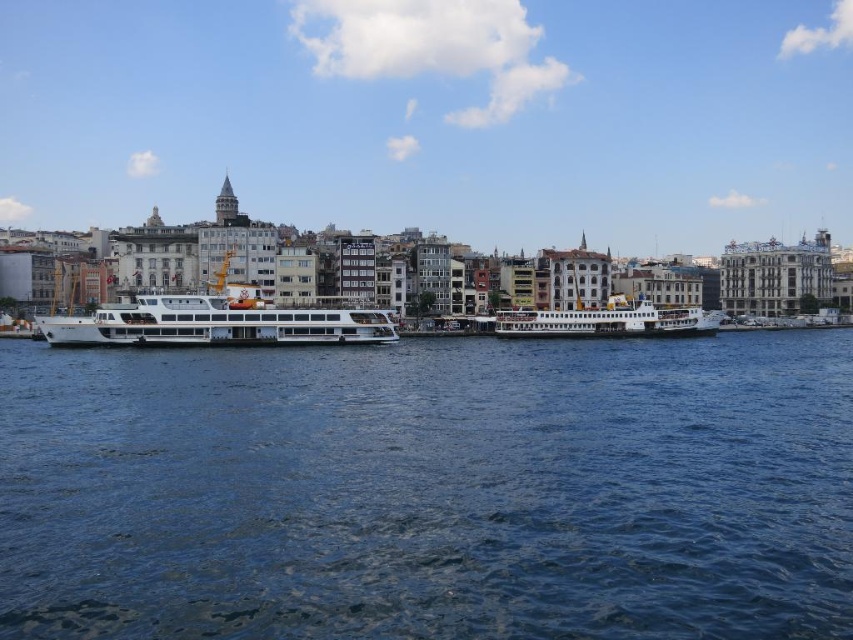
Question: Does blue water at center come in front of white glossy ferry at center?

Choices:
 (A) yes
 (B) no

Answer: (A)

Question: Among these objects, which one is farthest from the camera?

Choices:
 (A) blue water at center
 (B) white glossy ferry at center

Answer: (B)

Question: Can you confirm if white glossy cruise ship at center is wider than white glossy ferry at center?

Choices:
 (A) yes
 (B) no

Answer: (A)

Question: Which object is farther from the camera taking this photo?

Choices:
 (A) blue water at center
 (B) white glossy cruise ship at center
 (C) white glossy ferry at center

Answer: (C)

Question: Does blue water at center appear on the right side of white glossy ferry at center?

Choices:
 (A) yes
 (B) no

Answer: (B)

Question: Which of the following is the closest to the observer?

Choices:
 (A) (173, 451)
 (B) (187, 298)
 (C) (518, 326)

Answer: (A)